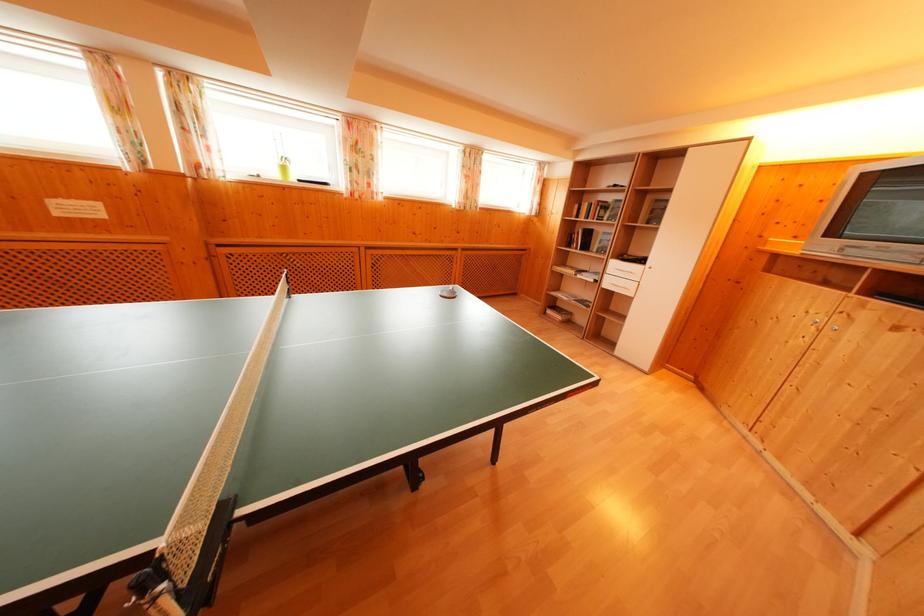
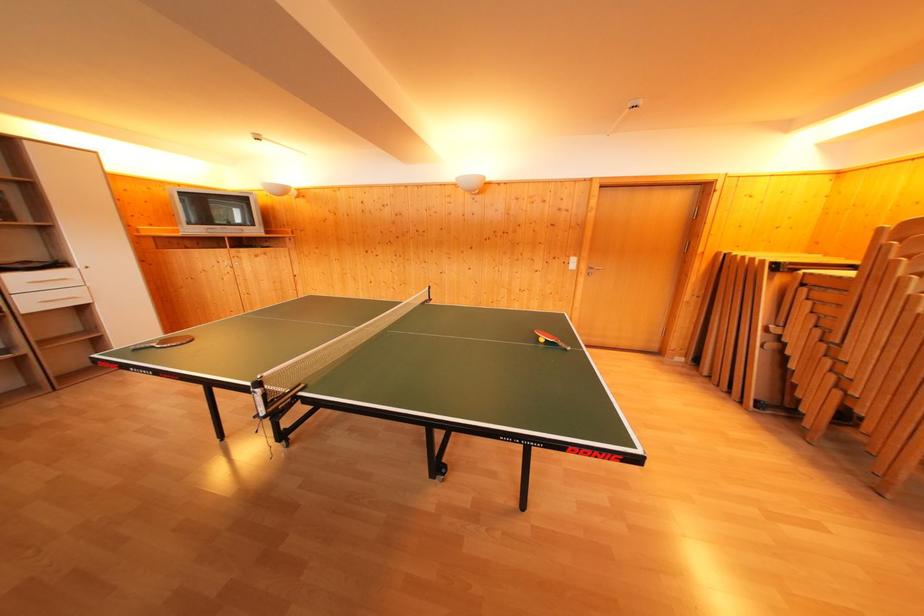
Find the pixel in the second image that matches pixel 647 265 in the first image.

(64, 270)